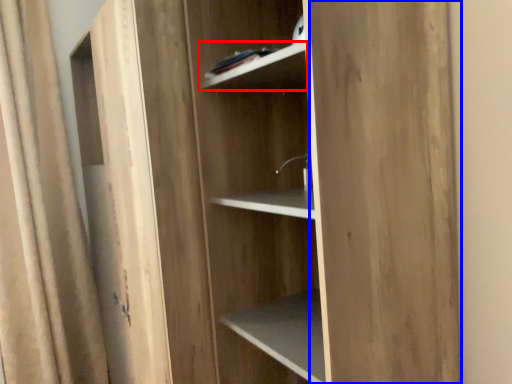
Question: Among these objects, which one is nearest to the camera, cabinet (highlighted by a red box) or plywood (highlighted by a blue box)?

Choices:
 (A) cabinet
 (B) plywood

Answer: (B)